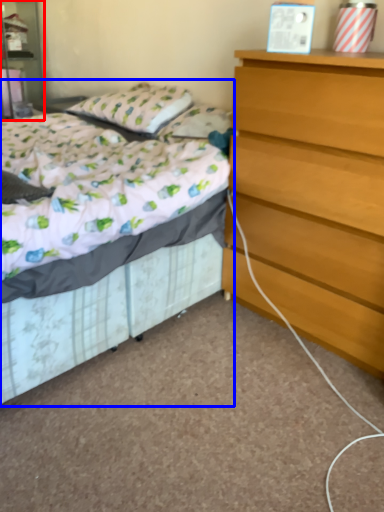
Question: Which point is further to the camera, nightstand (highlighted by a red box) or bed (highlighted by a blue box)?

Choices:
 (A) nightstand
 (B) bed

Answer: (A)